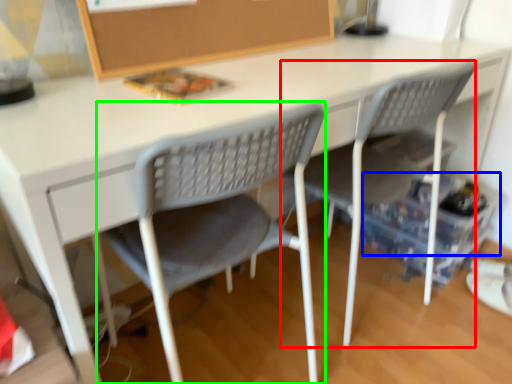
Question: Which is nearer to the chair (highlighted by a red box)? storage box (highlighted by a blue box) or chair (highlighted by a green box).

Choices:
 (A) storage box
 (B) chair

Answer: (A)